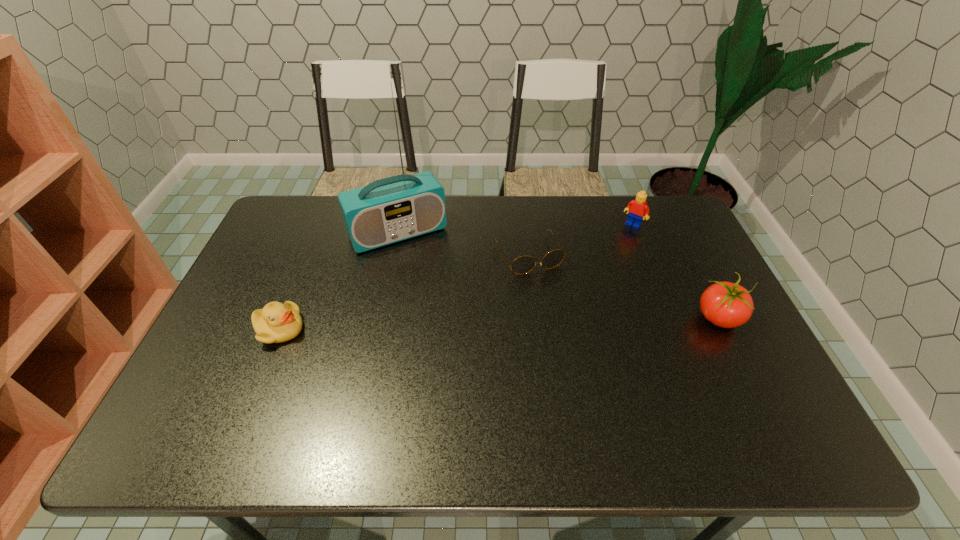
The height and width of the screenshot is (540, 960). In order to click on free region at the far left corner of the desktop in this screenshot , I will do `click(278, 229)`.

Where is `free space between the Lego and the second shortest object`? This screenshot has width=960, height=540. free space between the Lego and the second shortest object is located at coordinates (456, 277).

You are a GUI agent. You are given a task and a screenshot of the screen. Output one action in this format:
    pyautogui.click(x=<x>, y=<y>)
    Task: Click on the free spot between the leftmost object and the Lego
    The width and height of the screenshot is (960, 540).
    Given the screenshot: What is the action you would take?
    pyautogui.click(x=456, y=277)

Locate an element on the screen. The width and height of the screenshot is (960, 540). vacant region between the Lego and the leftmost object is located at coordinates (456, 277).

The height and width of the screenshot is (540, 960). I want to click on free space that is in between the leftmost object and the fourth object from left to right, so click(x=456, y=277).

Find the location of `vacant area that lies between the second object from right to left and the radio receiver`. vacant area that lies between the second object from right to left and the radio receiver is located at coordinates click(516, 229).

The image size is (960, 540). Find the location of `free space between the rightmost object and the shortest object`. free space between the rightmost object and the shortest object is located at coordinates (624, 286).

Identify the location of free area in between the second object from right to left and the shortest object. (581, 240).

At what (x,y) coordinates should I click in order to perform the action: click on empty space between the fourth tallest object and the fourth object from right to left. Please return your answer as a coordinate pair (x, y). The width and height of the screenshot is (960, 540). Looking at the image, I should click on (339, 281).

I want to click on free point between the leftmost object and the fourth object from left to right, so click(x=456, y=277).